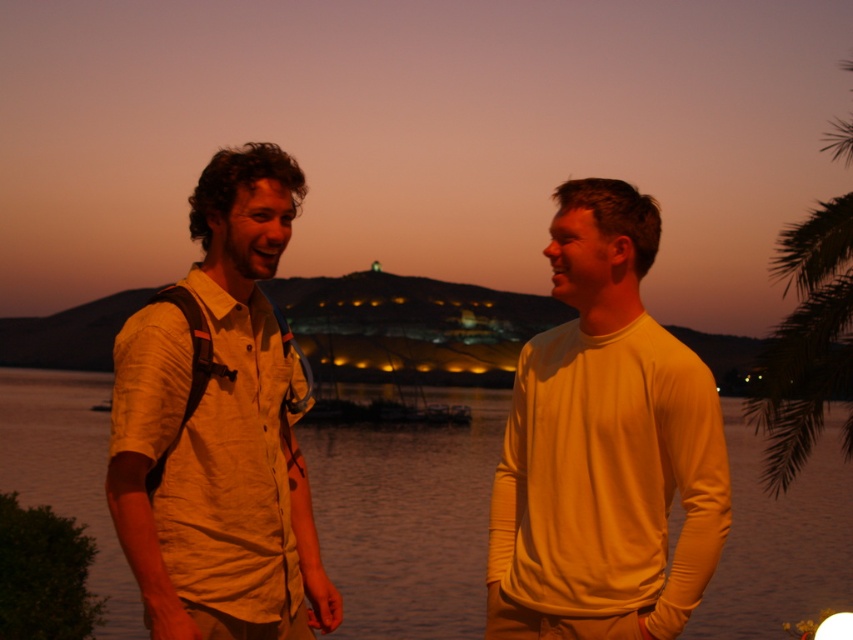
You are a photographer trying to capture a group photo of the two people in the scene. The camera you are using has a maximum focus range of 10 feet. Can you take a photo of both the beige cotton shirt at center and the beige cotton shirt at left without moving either of them?

The beige cotton shirt at center is 11.14 feet from the beige cotton shirt at left. Since the camera can only focus up to 10 feet, the distance between them exceeds the maximum range. Therefore, you cannot take a photo of both without moving them.

You are taking a photo of two people standing near a lake at sunset. You want to focus on the person closer to the camera. Which of the two points, point (579, 228) or point (194, 532), should you adjust your camera to focus on?

Point (579, 228) is further to the camera than point (194, 532), so you should focus on point (579, 228) to capture the person closer to the camera.